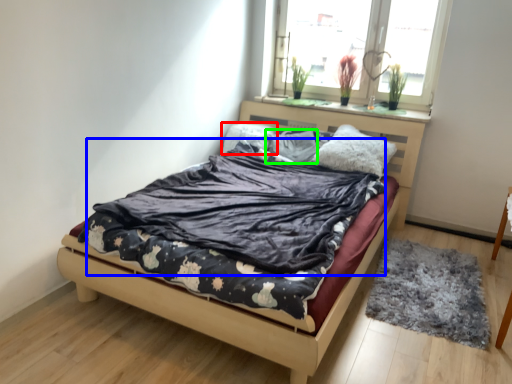
Question: Which object is positioned farthest from pillow (highlighted by a red box)? Select from blanket (highlighted by a blue box) and pillow (highlighted by a green box).

Choices:
 (A) blanket
 (B) pillow

Answer: (A)